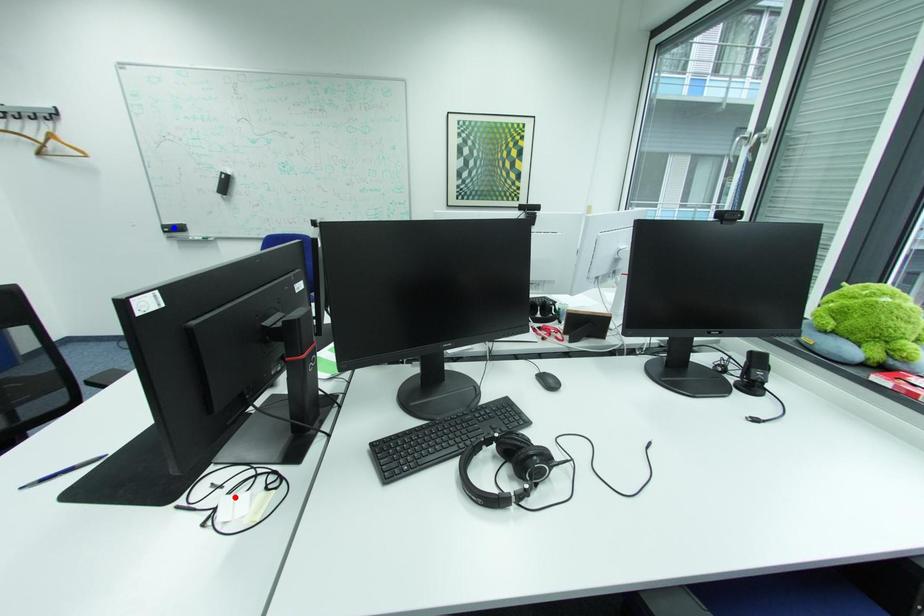
Question: Which of the two points in the image is closer to the camera?

Choices:
 (A) Blue point is closer.
 (B) Red point is closer.

Answer: (B)